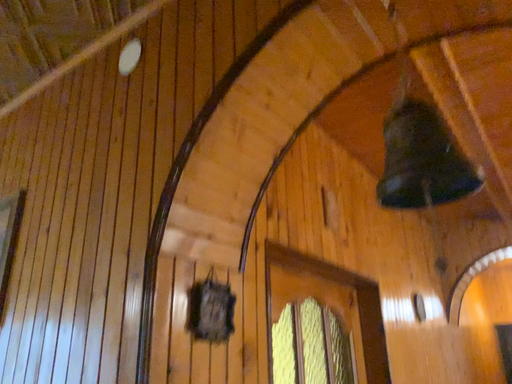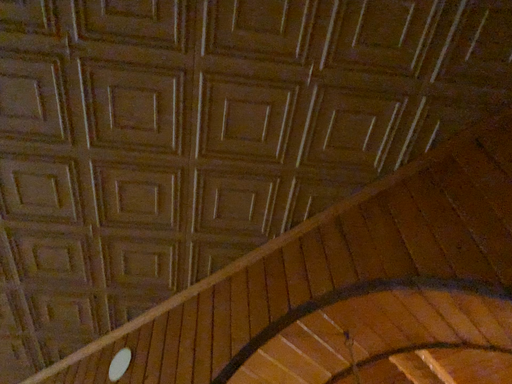
Question: Which way did the camera rotate in the video?

Choices:
 (A) rotated upward
 (B) rotated downward

Answer: (A)